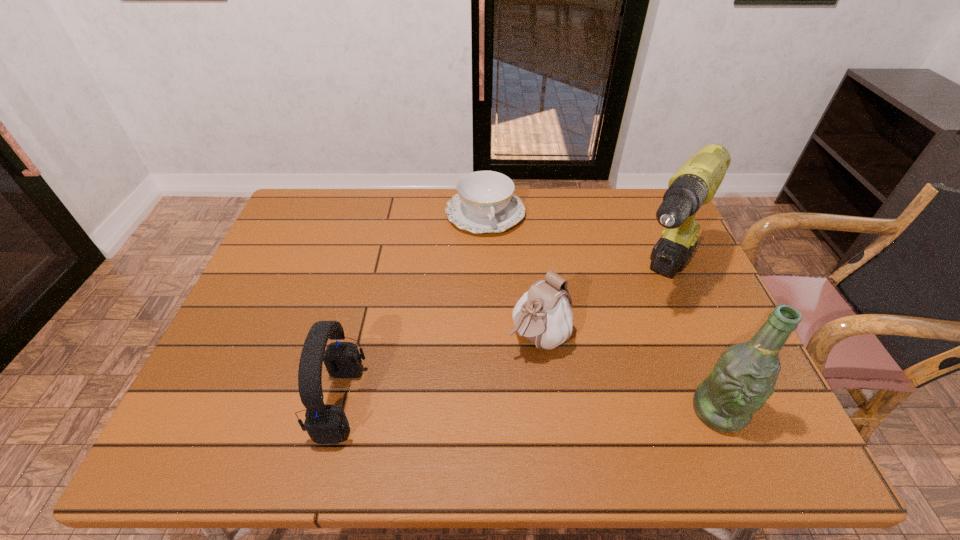
Where is `headset`? headset is located at coordinates (325, 424).

Where is `beer bottle`? This screenshot has height=540, width=960. beer bottle is located at coordinates (744, 377).

What are the coordinates of `pouch` in the screenshot? It's located at (543, 315).

Locate an element on the screen. The width and height of the screenshot is (960, 540). chinaware is located at coordinates (485, 202).

Locate an element on the screen. This screenshot has width=960, height=540. the shortest object is located at coordinates (485, 202).

This screenshot has height=540, width=960. Find the location of `drill`. drill is located at coordinates (696, 182).

The height and width of the screenshot is (540, 960). I want to click on free space located on the headband of the leftmost object, so click(245, 402).

Image resolution: width=960 pixels, height=540 pixels. Identify the location of free spot located on the headband of the leftmost object. click(235, 402).

Locate an element on the screen. vacant region located on the headband of the leftmost object is located at coordinates (227, 402).

Find the location of a particular element. The width and height of the screenshot is (960, 540). vacant space located 0.070m on the front-facing side of the pouch is located at coordinates (499, 376).